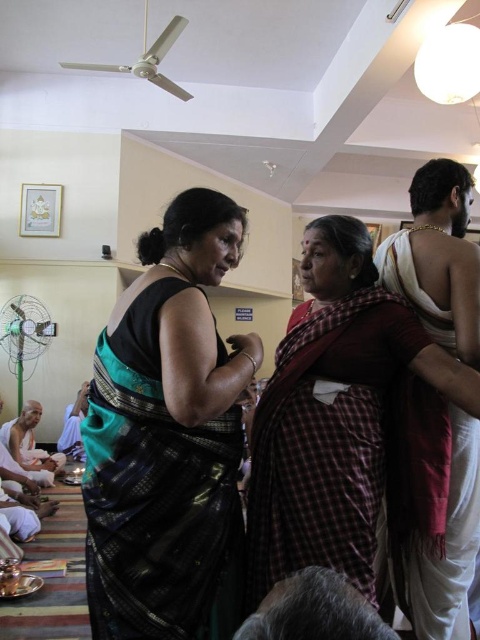
Question: Among these objects, which one is nearest to the camera?

Choices:
 (A) red plaid sari at center
 (B) black silk saree at center

Answer: (B)

Question: Which point is farther to the camera?

Choices:
 (A) red plaid sari at center
 (B) black silk saree at center

Answer: (A)

Question: Does black silk saree at center appear on the right side of red plaid sari at center?

Choices:
 (A) yes
 (B) no

Answer: (B)

Question: Does black silk saree at center appear on the right side of red plaid sari at center?

Choices:
 (A) no
 (B) yes

Answer: (A)

Question: Among these objects, which one is farthest from the camera?

Choices:
 (A) red plaid sari at center
 (B) black silk saree at center

Answer: (A)

Question: From the image, what is the correct spatial relationship of black silk saree at center in relation to red plaid sari at center?

Choices:
 (A) above
 (B) below

Answer: (A)